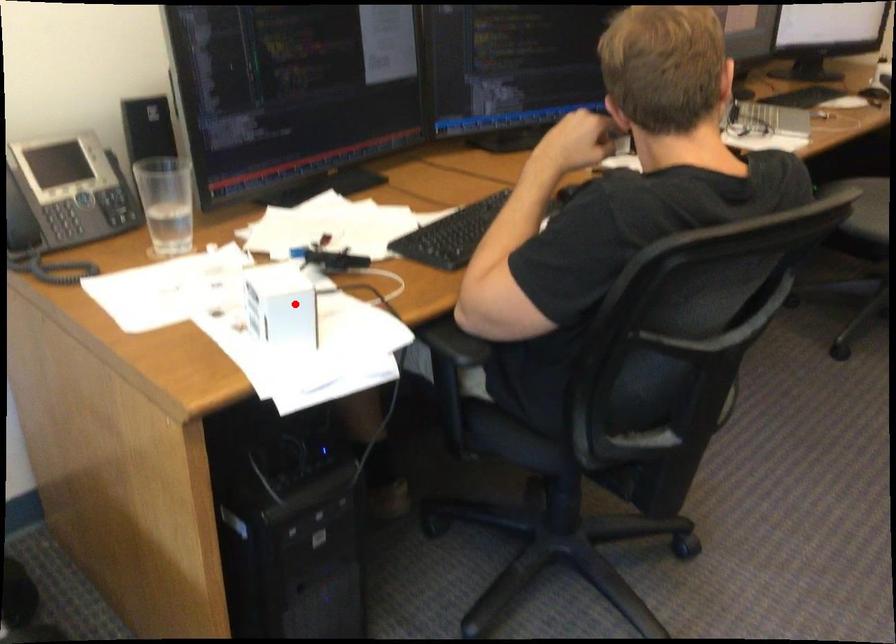
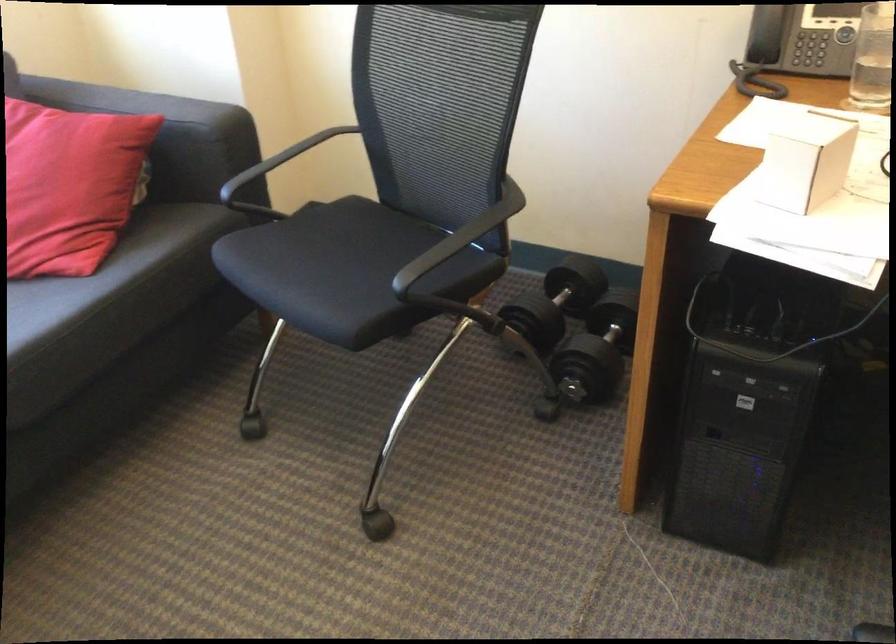
Find the pixel in the second image that matches the highlighted location in the first image.

(805, 162)